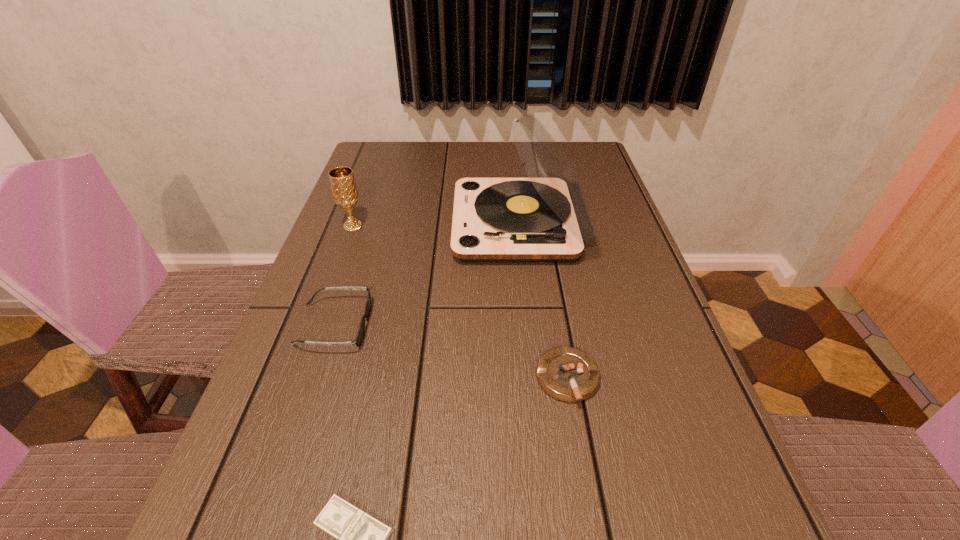
I want to click on record player, so click(544, 218).

At what (x,y) coordinates should I click in order to perform the action: click on chalice. Please return your answer as a coordinate pair (x, y). The image size is (960, 540). Looking at the image, I should click on (345, 194).

Find the location of a particular element. Image resolution: width=960 pixels, height=540 pixels. sunglasses is located at coordinates click(358, 339).

Locate an element on the screen. ashtray is located at coordinates (568, 374).

Image resolution: width=960 pixels, height=540 pixels. Identify the location of free space located 0.240m with the tonearm facing the front of the tallest object. 361,224.

Identify the location of vacant area situated 0.060m with the tonearm facing the front of the tallest object. This screenshot has height=540, width=960. (430, 224).

The image size is (960, 540). I want to click on free space located 0.100m with the tonearm facing the front of the tallest object, so click(x=415, y=224).

Image resolution: width=960 pixels, height=540 pixels. I want to click on vacant region located on the back of the chalice, so click(x=366, y=190).

Locate an element on the screen. The image size is (960, 540). vacant space located on the front-facing side of the sunglasses is located at coordinates (534, 325).

The height and width of the screenshot is (540, 960). Find the location of `vacant space positioned on the back of the second shortest object`. vacant space positioned on the back of the second shortest object is located at coordinates (556, 313).